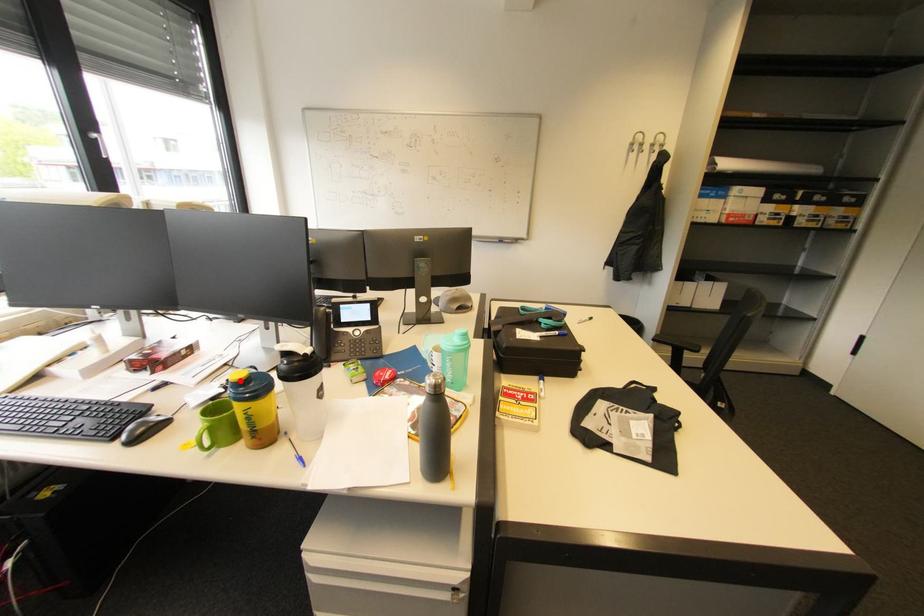
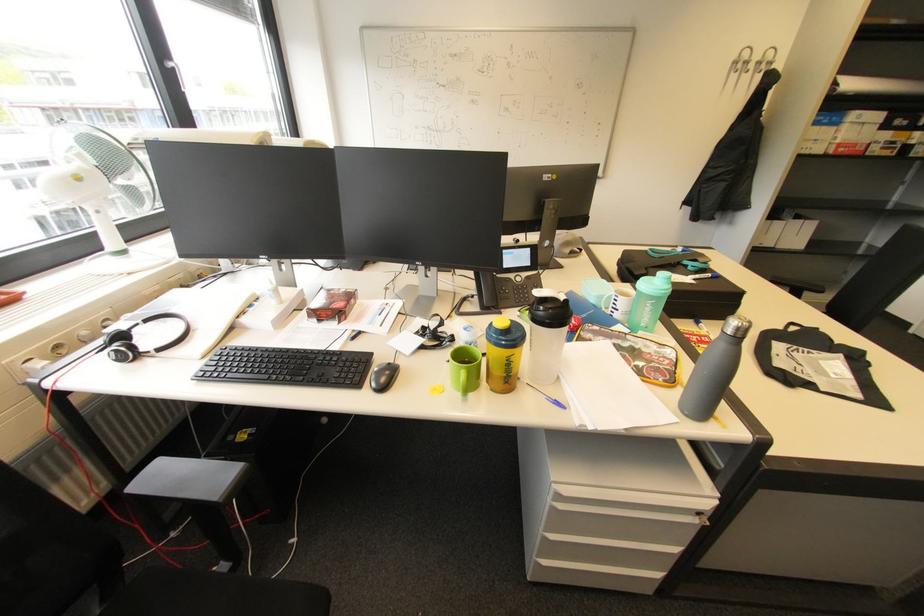
Question: A red point is marked in image1. In image2, is the corresponding 3D point closer to the camera or farther? Reply with the corresponding letter.

Choices:
 (A) The corresponding 3D point is closer.
 (B) The corresponding 3D point is farther.

Answer: (B)